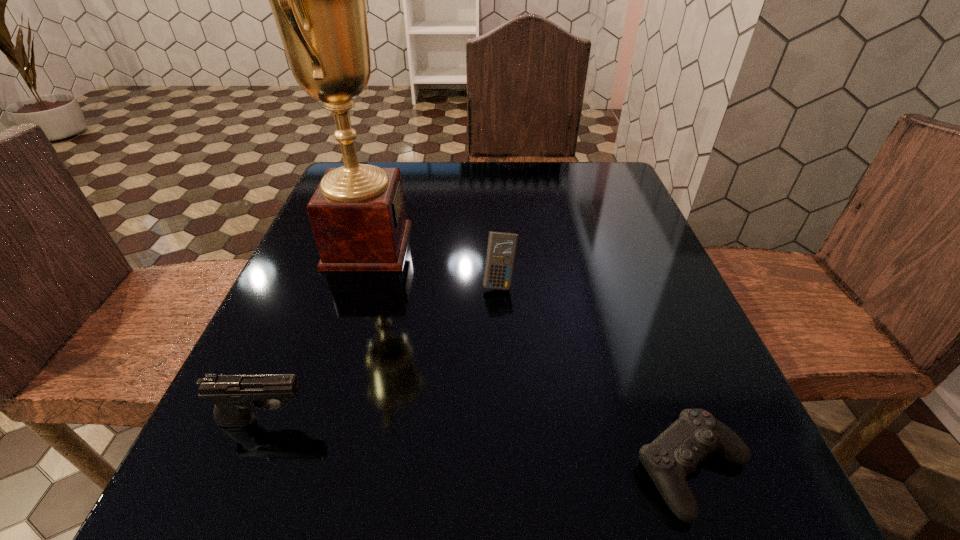
You are a GUI agent. You are given a task and a screenshot of the screen. Output one action in this format:
    pyautogui.click(x=<x>, y=<y>)
    Task: Click on the trophy cup present at the left edge
    This screenshot has width=960, height=540.
    Given the screenshot: What is the action you would take?
    pyautogui.click(x=357, y=213)

Identify the location of pistol that is at the left edge. (234, 396).

At what (x,y) coordinates should I click in order to perform the action: click on object that is positioned at the right edge. Please return your answer as a coordinate pair (x, y). The image size is (960, 540). Looking at the image, I should click on (675, 453).

This screenshot has height=540, width=960. I want to click on object at the near right corner, so click(675, 453).

In the image, there is a desktop. At what (x,y) coordinates should I click in order to perform the action: click on vacant space at the far edge. Please return your answer as a coordinate pair (x, y). This screenshot has height=540, width=960. Looking at the image, I should click on (525, 163).

Find the location of a particular element. This screenshot has height=540, width=960. vacant space at the near edge of the desktop is located at coordinates (531, 498).

I want to click on vacant space at the left edge, so click(322, 414).

Where is `free space at the right edge of the desktop`? The width and height of the screenshot is (960, 540). free space at the right edge of the desktop is located at coordinates click(x=642, y=339).

Locate an element on the screen. This screenshot has height=540, width=960. vacant space at the near left corner is located at coordinates (223, 483).

In the image, there is a desktop. At what (x,y) coordinates should I click in order to perform the action: click on free space at the far right corner. Please return your answer as a coordinate pair (x, y). The height and width of the screenshot is (540, 960). Looking at the image, I should click on (583, 171).